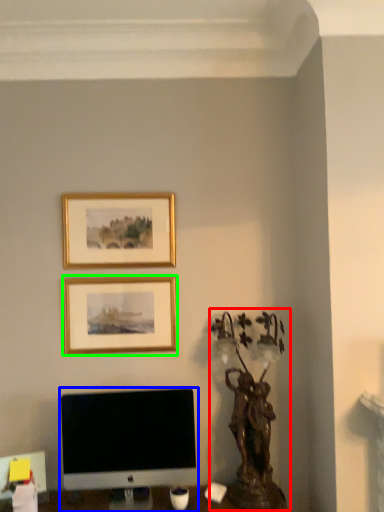
Question: Considering the real-world distances, which object is farthest from bronze statue (highlighted by a red box)? computer monitor (highlighted by a blue box) or picture frame (highlighted by a green box)?

Choices:
 (A) computer monitor
 (B) picture frame

Answer: (B)